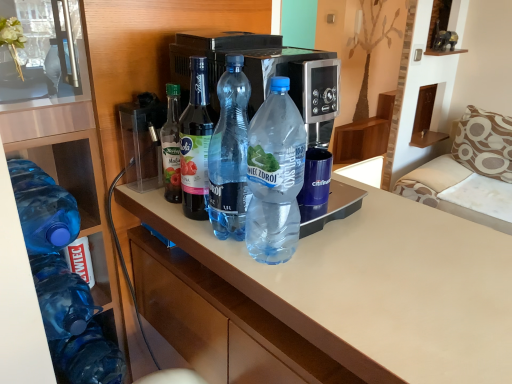
I want to click on vacant space in front of transparent plastic bottle at center, the 4th bottle when ordered from left to right, so click(x=262, y=274).